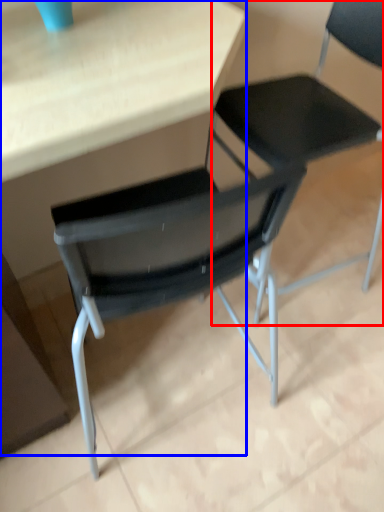
Question: Which point is further to the camera, chair (highlighted by a red box) or table (highlighted by a blue box)?

Choices:
 (A) chair
 (B) table

Answer: (A)